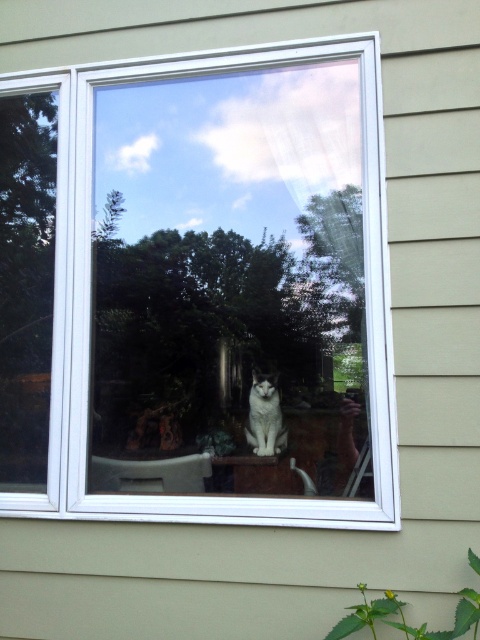
Question: Can you confirm if white plastic window at center is thinner than white fur cat at center?

Choices:
 (A) yes
 (B) no

Answer: (B)

Question: Does white plastic window at center appear on the right side of white fur cat at center?

Choices:
 (A) yes
 (B) no

Answer: (B)

Question: Can you confirm if white plastic window at center is positioned to the left of white fur cat at center?

Choices:
 (A) no
 (B) yes

Answer: (B)